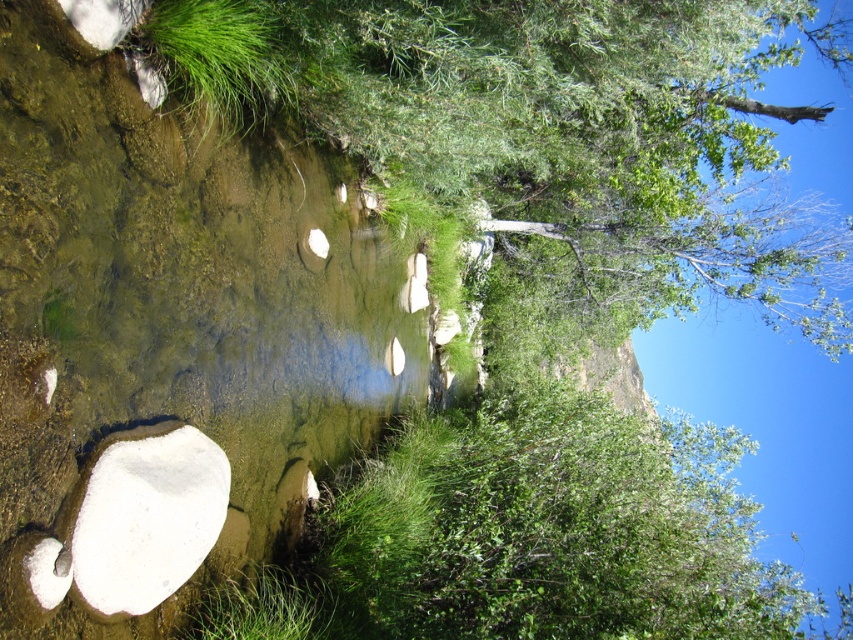
Based on the photo, which is more to the left, green leafy tree at center or green leafy grass at upper left?

From the viewer's perspective, green leafy grass at upper left appears more on the left side.

Is point (788, 44) positioned in front of point (190, 61)?

That is False.

Identify the location of green leafy tree at center. This screenshot has height=640, width=853. (543, 134).

Describe the element at coordinates (216, 58) in the screenshot. The image size is (853, 640). I see `green leafy grass at upper left` at that location.

Does green leafy grass at upper left come in front of green leafy grass at lower center?

No, green leafy grass at upper left is further to the viewer.

Between point (204, 81) and point (322, 608), which one is positioned in front?

Point (204, 81) is more forward.

Locate an element on the screen. The height and width of the screenshot is (640, 853). green leafy grass at upper left is located at coordinates (216, 58).

Can you confirm if green leafy tree at center is thinner than green leafy grass at lower center?

No.

Is the position of green leafy tree at center more distant than that of green leafy grass at lower center?

That is True.

Is point (469, 125) closer to camera compared to point (317, 636)?

No, it is behind (317, 636).

The image size is (853, 640). I want to click on green leafy tree at center, so click(x=543, y=134).